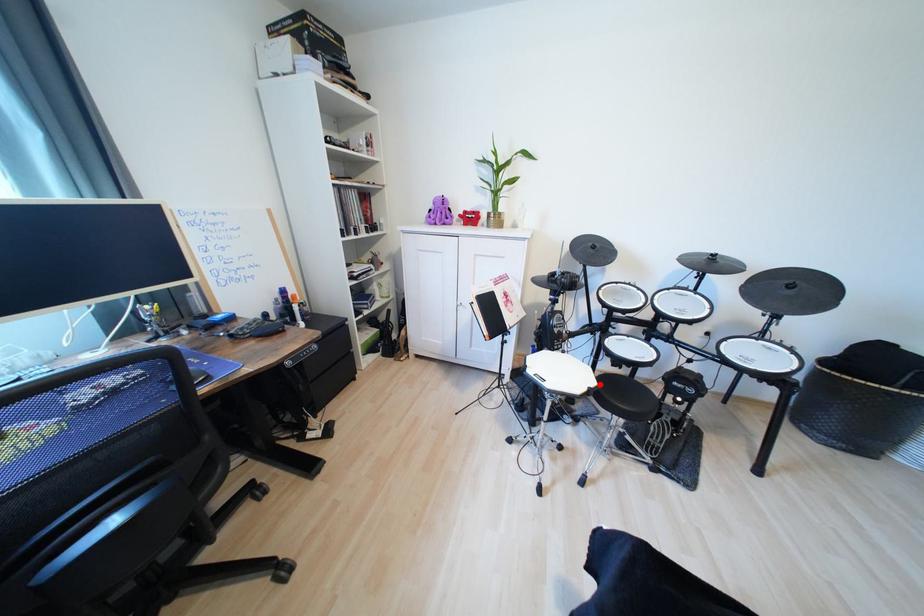
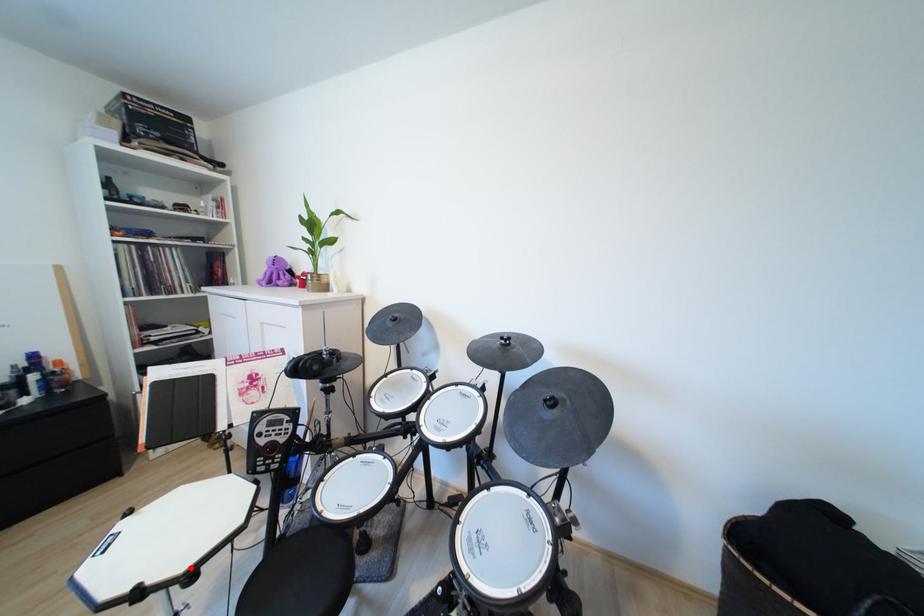
I am providing you with two images of the same scene from different viewpoints. A red point is marked on the first image and another point is marked on the second image. Is the marked point in image1 the same physical position as the marked point in image2?

Yes